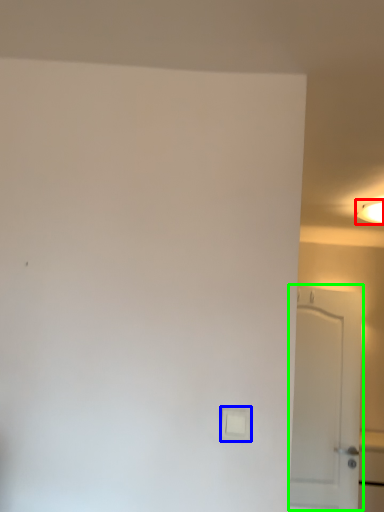
Question: Based on their relative distances, which object is farther from lighting (highlighted by a red box)? Choose from light switch (highlighted by a blue box) and door (highlighted by a green box).

Choices:
 (A) light switch
 (B) door

Answer: (A)